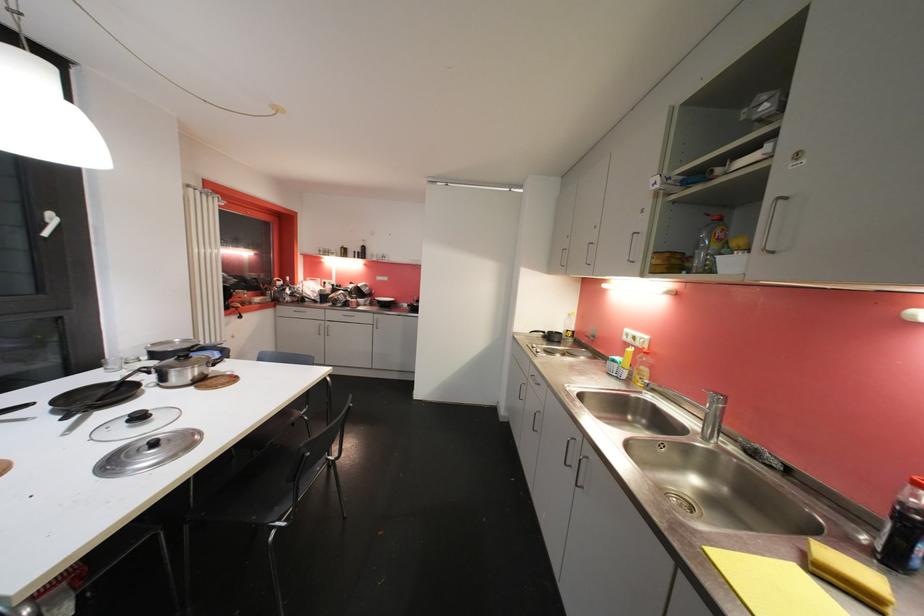
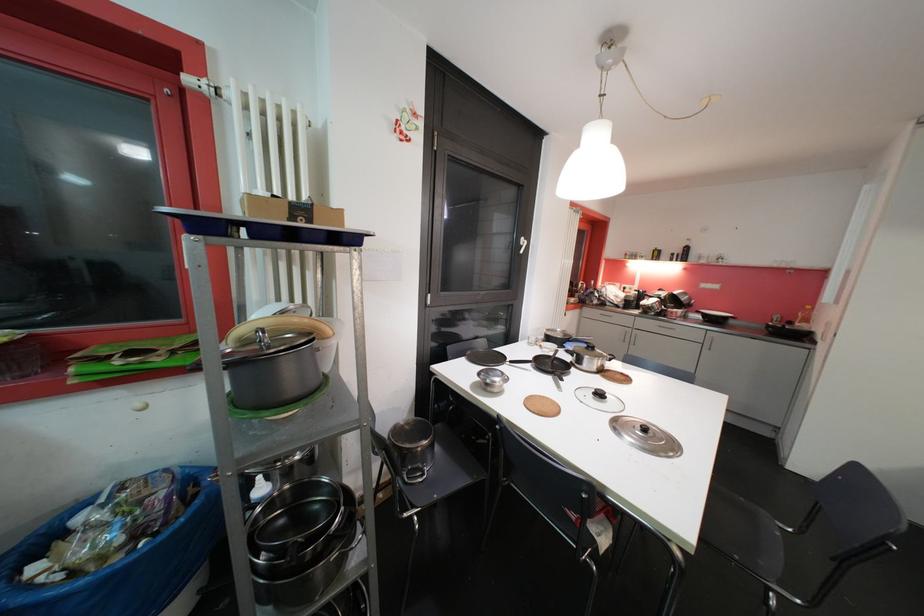
Locate, in the second image, the point that corresponds to point 55,216 in the first image.

(528, 241)